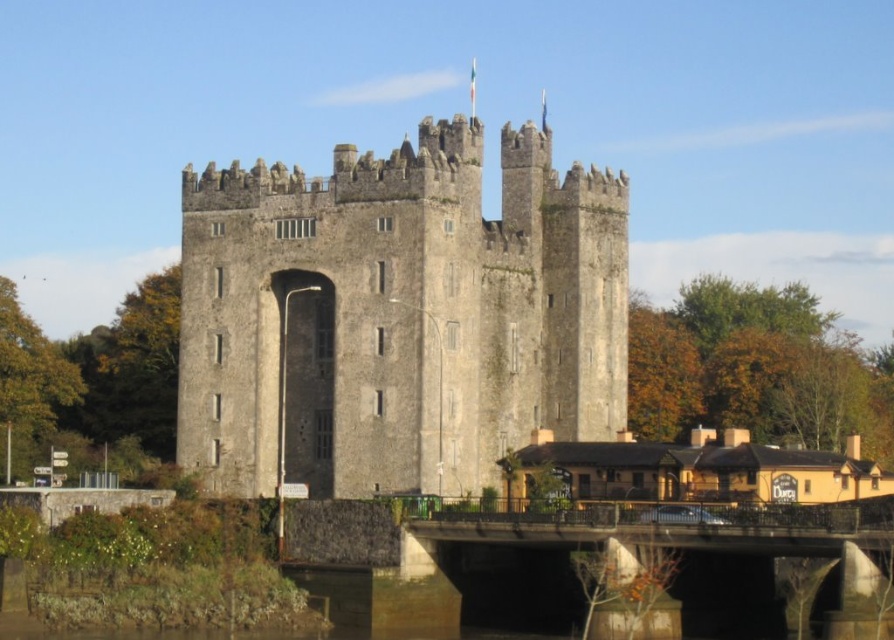
You are a tourist standing at the base of the gray stone castle at center. You want to cross the concrete bridge at lower center to reach the other side. Is the bridge directly under the castle, or is it positioned to the side?

The gray stone castle at center is located above the concrete bridge at lower center, so the bridge is directly under the castle.

You are a tourist standing on the concrete bridge at lower center and want to take a photo of the gray stone castle at center. Which direction should you face to capture the castle in your shot?

You should face to the right to capture the gray stone castle at center in your shot since the gray stone castle at center is located to the left of the concrete bridge at lower center.